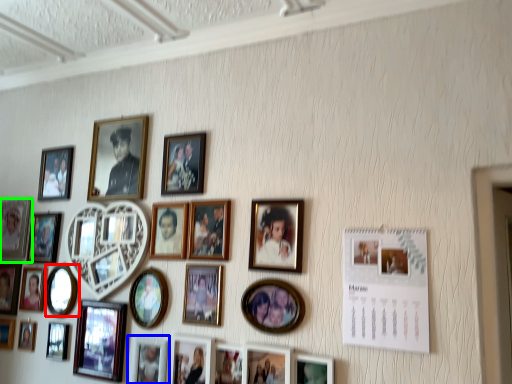
Question: Considering the real-world distances, which object is closest to picture frame (highlighted by a red box)? picture frame (highlighted by a blue box) or picture frame (highlighted by a green box).

Choices:
 (A) picture frame
 (B) picture frame

Answer: (B)